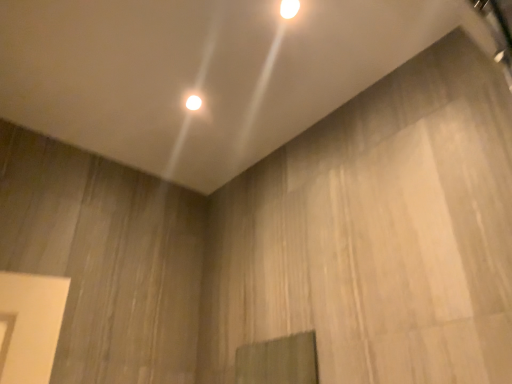
Question: From a real-world perspective, is white glossy light fixture at upper center, which is counted as the 1th lamp, starting from the front, above or below white glossy light fixture at upper center, which appears as the second lamp when viewed from the front?

Choices:
 (A) below
 (B) above

Answer: (A)

Question: Is white glossy light fixture at upper center, the 2th lamp positioned from the back, situated inside white glossy light fixture at upper center, the 1th lamp when ordered from left to right, or outside?

Choices:
 (A) inside
 (B) outside

Answer: (B)

Question: From the image's perspective, is white glossy light fixture at upper center, which appears as the second lamp when ordered from the bottom, above or below white glossy light fixture at upper center, the 1th lamp when ordered from left to right?

Choices:
 (A) below
 (B) above

Answer: (B)

Question: From the image's perspective, is white glossy light fixture at upper center, the 1th lamp when ordered from left to right, above or below white glossy light fixture at upper center, positioned as the first lamp in top-to-bottom order?

Choices:
 (A) below
 (B) above

Answer: (A)

Question: Considering the positions of white glossy light fixture at upper center, acting as the 2th lamp starting from the right, and white glossy light fixture at upper center, which is counted as the 1th lamp, starting from the front, in the image, is white glossy light fixture at upper center, acting as the 2th lamp starting from the right, bigger or smaller than white glossy light fixture at upper center, which is counted as the 1th lamp, starting from the front,?

Choices:
 (A) small
 (B) big

Answer: (A)

Question: Is white glossy light fixture at upper center, the 1th lamp when ordered from left to right, to the left or to the right of white glossy light fixture at upper center, the 2th lamp positioned from the back, in the image?

Choices:
 (A) left
 (B) right

Answer: (A)

Question: Would you say white glossy light fixture at upper center, the first lamp in the back-to-front sequence, is inside or outside white glossy light fixture at upper center, the 2th lamp positioned from the left?

Choices:
 (A) inside
 (B) outside

Answer: (B)